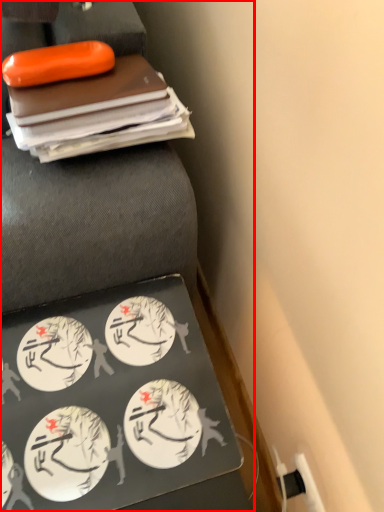
Question: Considering the relative positions of furniture (annotated by the red box) and food in the image provided, where is furniture (annotated by the red box) located with respect to the staircase?

Choices:
 (A) left
 (B) right

Answer: (A)